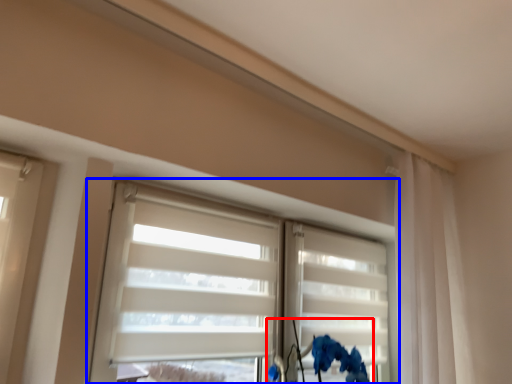
Question: Which of the following is the farthest to the observer, floral arrangement (highlighted by a red box) or window (highlighted by a blue box)?

Choices:
 (A) floral arrangement
 (B) window

Answer: (A)